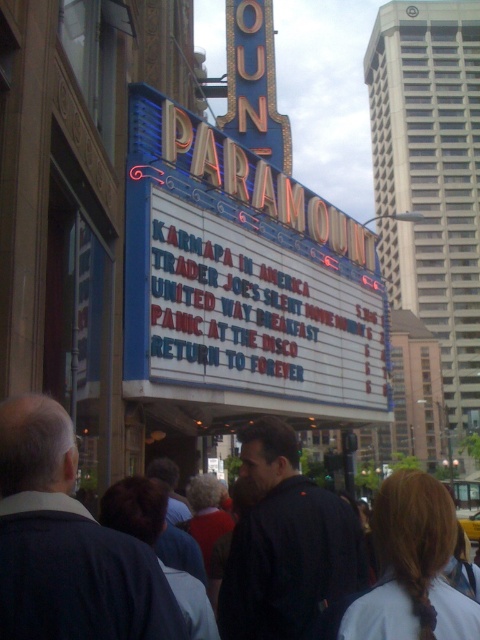
Question: Can you confirm if dark blue clothing at center is positioned above yellow rubber taxi at center?

Choices:
 (A) no
 (B) yes

Answer: (B)

Question: Is dark blue clothing at center below yellow rubber taxi at center?

Choices:
 (A) no
 (B) yes

Answer: (A)

Question: In this image, where is dark blue clothing at center located relative to yellow rubber taxi at center?

Choices:
 (A) above
 (B) below

Answer: (A)

Question: Which of the following is the closest to the observer?

Choices:
 (A) dark blue clothing at center
 (B) yellow rubber taxi at center

Answer: (A)

Question: Which of the following is the farthest from the observer?

Choices:
 (A) (468, 538)
 (B) (39, 554)

Answer: (A)